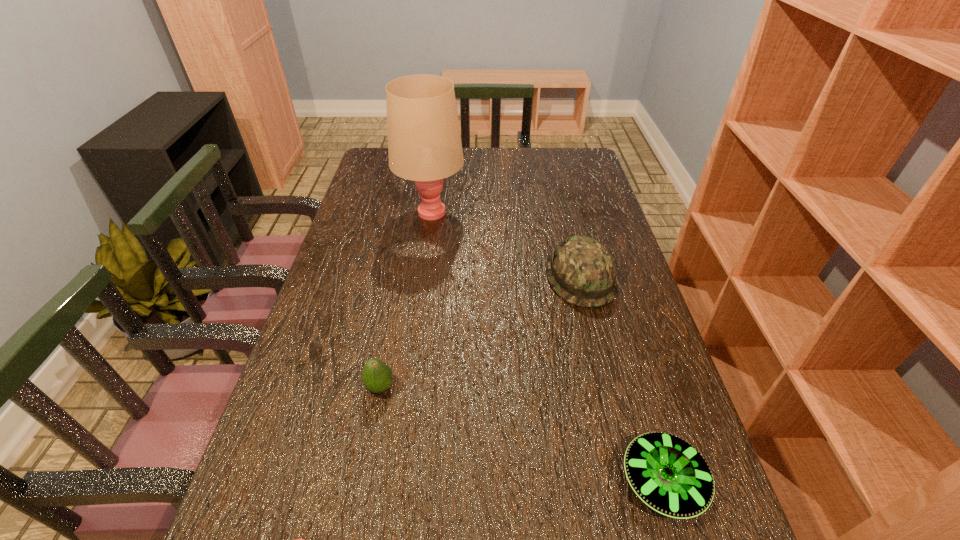
You are a GUI agent. You are given a task and a screenshot of the screen. Output one action in this format:
    pyautogui.click(x=<x>, y=<y>)
    Task: Click on the tallest object
    The width and height of the screenshot is (960, 540).
    Given the screenshot: What is the action you would take?
    pyautogui.click(x=424, y=144)

Locate an element on the screen. The height and width of the screenshot is (540, 960). the farthest object is located at coordinates (424, 144).

Find the location of `the fourth shortest object`. the fourth shortest object is located at coordinates (581, 270).

Locate an element on the screen. the second farthest object is located at coordinates (581, 270).

At what (x,y) coordinates should I click in order to perform the action: click on avocado. Please return your answer as a coordinate pair (x, y). The image size is (960, 540). Looking at the image, I should click on (377, 376).

What are the coordinates of `the third nearest object` in the screenshot? It's located at (377, 376).

Where is `saucer`? The width and height of the screenshot is (960, 540). saucer is located at coordinates (668, 474).

Where is `the second shortest object`? the second shortest object is located at coordinates (668, 474).

The height and width of the screenshot is (540, 960). I want to click on free space located on the front of the tallest object, so click(424, 264).

Identify the location of free space located 0.340m on the front of the second tallest object. The width and height of the screenshot is (960, 540). (618, 433).